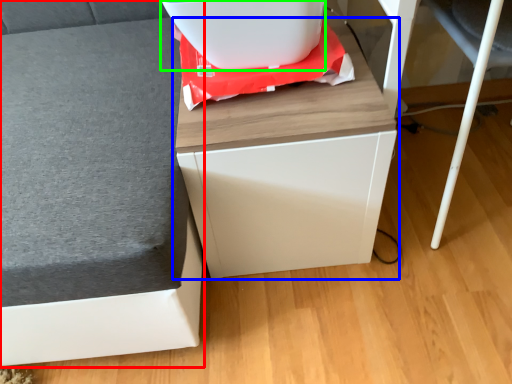
Question: Which is nearer to the furniture (highlighted by a red box)? furniture (highlighted by a blue box) or appliance (highlighted by a green box).

Choices:
 (A) furniture
 (B) appliance

Answer: (A)